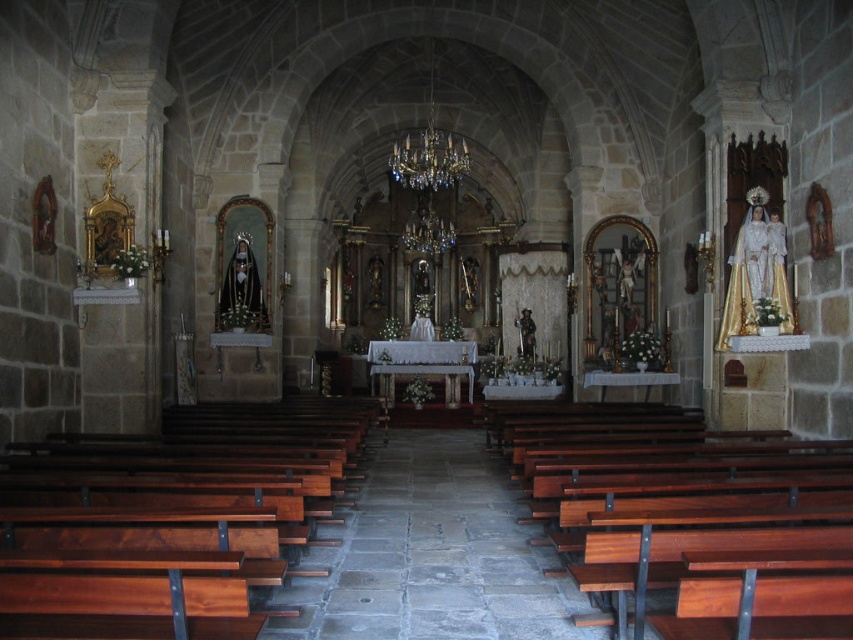
Question: Which point is farther to the camera?

Choices:
 (A) brown polished wood at left
 (B) polished wood bench at lower right

Answer: (B)

Question: Does brown polished wood at left have a lesser width compared to polished wood bench at lower right?

Choices:
 (A) no
 (B) yes

Answer: (A)

Question: From the image, what is the correct spatial relationship of brown polished wood at left in relation to polished wood bench at lower right?

Choices:
 (A) right
 (B) left

Answer: (B)

Question: Is brown polished wood at left bigger than polished wood bench at lower right?

Choices:
 (A) yes
 (B) no

Answer: (B)